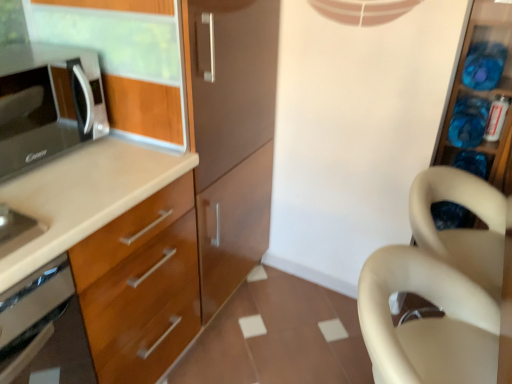
What is the approximate width of translucent plastic containers at right?

The width of translucent plastic containers at right is 20.98 inches.

Describe the element at coordinates (485, 91) in the screenshot. This screenshot has height=384, width=512. I see `translucent plastic containers at right` at that location.

In order to face satin silver oven at lower left, should I rotate leftwards or rightwards?

It's best to rotate left around 31.600 degrees.

Describe the element at coordinates (444, 288) in the screenshot. I see `beige matte chair at right` at that location.

Where is `beige plastic swivel chair at right`? beige plastic swivel chair at right is located at coordinates (426, 321).

Considering the relative positions of matte black microwave at left and beige plastic swivel chair at right in the image provided, is matte black microwave at left to the left of beige plastic swivel chair at right from the viewer's perspective?

Correct, you'll find matte black microwave at left to the left of beige plastic swivel chair at right.

Which object is more forward, matte black microwave at left or beige plastic swivel chair at right?

beige plastic swivel chair at right is more forward.

Which object is wider, matte black microwave at left or beige plastic swivel chair at right?

Wider between the two is beige plastic swivel chair at right.

Is matte black microwave at left placed right next to beige plastic swivel chair at right?

No, matte black microwave at left is not beside beige plastic swivel chair at right.

Can you confirm if translucent plastic containers at right is positioned to the right of matte black microwave at left?

Correct, you'll find translucent plastic containers at right to the right of matte black microwave at left.

From a real-world perspective, which object rests below the other?

From a 3D spatial view, translucent plastic containers at right is below.

Is translucent plastic containers at right not inside matte black microwave at left?

translucent plastic containers at right lies outside matte black microwave at left's area.

Is matte black microwave at left at the back of translucent plastic containers at right?

No, translucent plastic containers at right is not facing the opposite direction of matte black microwave at left.

Is satin silver oven at lower left wider than translucent plastic containers at right?

In fact, satin silver oven at lower left might be narrower than translucent plastic containers at right.

Where is `oven in front of the translucent plastic containers at right`? This screenshot has height=384, width=512. oven in front of the translucent plastic containers at right is located at coordinates 44,329.

Is satin silver oven at lower left directly adjacent to translucent plastic containers at right?

No, satin silver oven at lower left is not touching translucent plastic containers at right.

How many degrees apart are the facing directions of satin silver oven at lower left and translucent plastic containers at right?

The angular difference between satin silver oven at lower left and translucent plastic containers at right is 91 degrees.

Is satin silver oven at lower left with matte black microwave at left?

No, satin silver oven at lower left is not beside matte black microwave at left.

Considering the relative positions of satin silver oven at lower left and matte black microwave at left in the image provided, is satin silver oven at lower left to the left or to the right of matte black microwave at left?

From the image, it's evident that satin silver oven at lower left is to the right of matte black microwave at left.

Between satin silver oven at lower left and matte black microwave at left, which one has smaller width?

matte black microwave at left is thinner.

Based on the photo, is beige matte chair at right aimed at satin silver oven at lower left?

No, beige matte chair at right is not facing towards satin silver oven at lower left.

Who is taller, beige matte chair at right or satin silver oven at lower left?

beige matte chair at right is taller.

Does beige matte chair at right have a greater width compared to satin silver oven at lower left?

In fact, beige matte chair at right might be narrower than satin silver oven at lower left.

From a real-world perspective, is beige matte chair at right located higher than satin silver oven at lower left?

No.

Is beige plastic swivel chair at right bigger or smaller than beige matte chair at right?

Clearly, beige plastic swivel chair at right is smaller in size than beige matte chair at right.

Does point (426, 348) come in front of point (357, 302)?

Yes, it is in front of point (357, 302).

Based on the photo, from a real-world perspective, is beige plastic swivel chair at right above or below beige matte chair at right?

From a real-world perspective, beige plastic swivel chair at right is physically above beige matte chair at right.

From the image's perspective, which one is positioned lower, beige plastic swivel chair at right or beige matte chair at right?

beige plastic swivel chair at right appears lower in the image.

The height and width of the screenshot is (384, 512). I want to click on swivel chair in front of the translucent plastic containers at right, so point(426,321).

Is beige plastic swivel chair at right turned away from translucent plastic containers at right?

beige plastic swivel chair at right does not have its back to translucent plastic containers at right.

From a real-world perspective, who is located higher, beige plastic swivel chair at right or translucent plastic containers at right?

From a 3D spatial view, translucent plastic containers at right is above.

Locate an element on the screen. swivel chair on the right of matte black microwave at left is located at coordinates (426, 321).

Where is `microwave oven that is above the translucent plastic containers at right (from the image's perspective)`? This screenshot has width=512, height=384. microwave oven that is above the translucent plastic containers at right (from the image's perspective) is located at coordinates (47, 103).

From the image, which object appears to be farther from matte black microwave at left, beige matte chair at right or beige plastic swivel chair at right?

Among the two, beige matte chair at right is located further to matte black microwave at left.

Estimate the real-world distances between objects in this image. Which object is further from translucent plastic containers at right, beige plastic swivel chair at right or beige matte chair at right?

beige plastic swivel chair at right lies further to translucent plastic containers at right than the other object.

Considering their positions, is beige matte chair at right positioned closer to beige plastic swivel chair at right than satin silver oven at lower left?

beige matte chair at right is positioned closer to the anchor beige plastic swivel chair at right.

When comparing their distances from translucent plastic containers at right, does matte black microwave at left or beige plastic swivel chair at right seem closer?

beige plastic swivel chair at right lies closer to translucent plastic containers at right than the other object.

Considering their positions, is beige plastic swivel chair at right positioned closer to matte black microwave at left than beige matte chair at right?

beige plastic swivel chair at right is closer to matte black microwave at left.

When comparing their distances from translucent plastic containers at right, does beige plastic swivel chair at right or satin silver oven at lower left seem closer?

beige plastic swivel chair at right is closer to translucent plastic containers at right.

Considering their positions, is beige matte chair at right positioned further to beige plastic swivel chair at right than translucent plastic containers at right?

Based on the image, translucent plastic containers at right appears to be further to beige plastic swivel chair at right.

When comparing their distances from matte black microwave at left, does satin silver oven at lower left or translucent plastic containers at right seem closer?

satin silver oven at lower left is positioned closer to the anchor matte black microwave at left.

Where is `swivel chair between matte black microwave at left and beige matte chair at right in the horizontal direction`? swivel chair between matte black microwave at left and beige matte chair at right in the horizontal direction is located at coordinates [426, 321].

The width and height of the screenshot is (512, 384). I want to click on dresser between beige plastic swivel chair at right and translucent plastic containers at right along the z-axis, so click(444, 288).

Locate an element on the screen. dresser between satin silver oven at lower left and translucent plastic containers at right from left to right is located at coordinates (444, 288).

Find the location of a particular element. This screenshot has width=512, height=384. swivel chair between matte black microwave at left and translucent plastic containers at right is located at coordinates (426, 321).